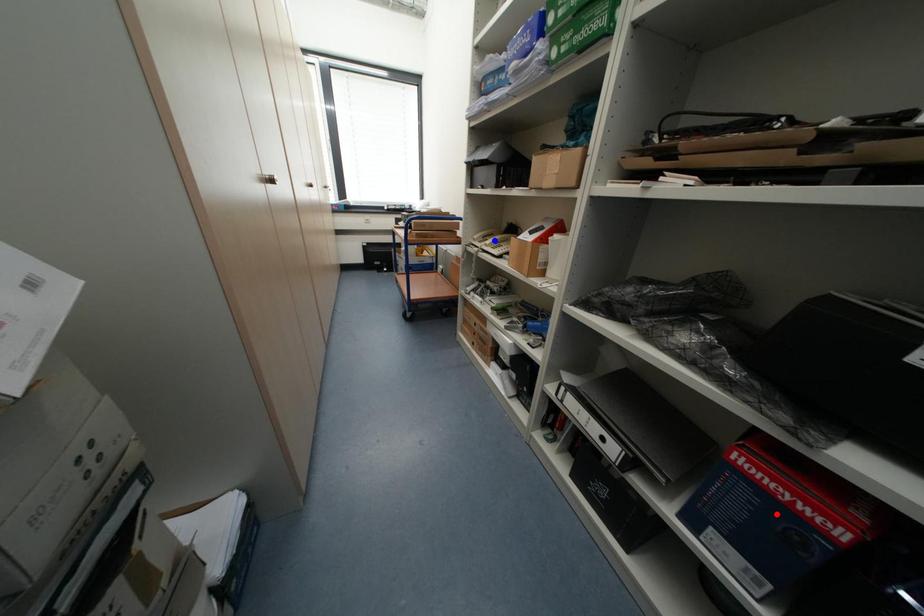
Question: Which of the two points in the image is closer to the camera?

Choices:
 (A) Blue point is closer.
 (B) Red point is closer.

Answer: (B)